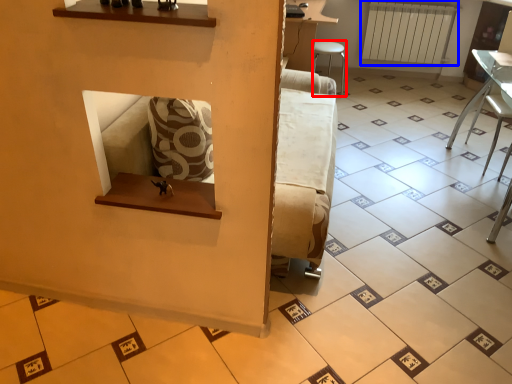
Question: Which point is further to the camera, furniture (highlighted by a red box) or radiator (highlighted by a blue box)?

Choices:
 (A) furniture
 (B) radiator

Answer: (B)